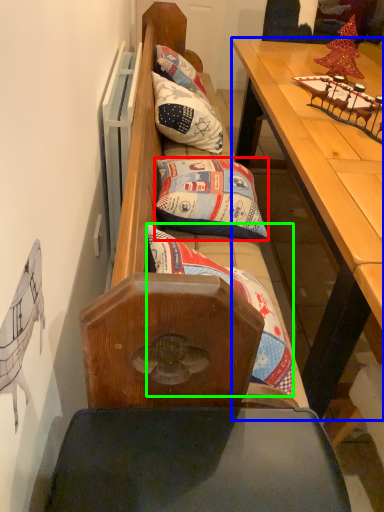
Question: Estimate the real-world distances between objects in this image. Which object is closer to pillow (highlighted by a red box), table (highlighted by a blue box) or pillow (highlighted by a green box)?

Choices:
 (A) table
 (B) pillow

Answer: (B)